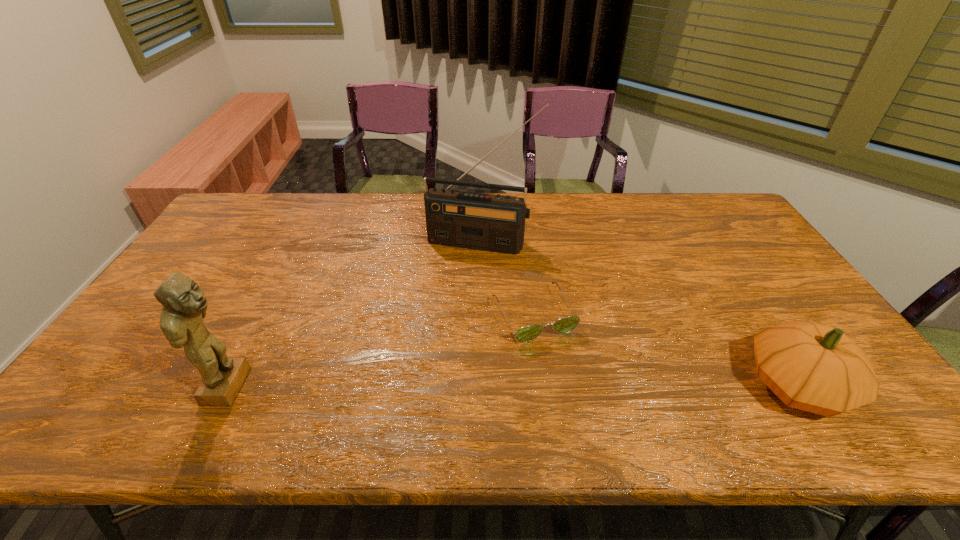
Identify the location of vacant area that lies between the leftmost object and the shortest object. (382, 350).

The width and height of the screenshot is (960, 540). I want to click on vacant space that is in between the shortest object and the third tallest object, so click(x=665, y=350).

Image resolution: width=960 pixels, height=540 pixels. What are the coordinates of `vacant space that is in between the gourd and the leftmost object` in the screenshot? It's located at (514, 386).

Identify the location of empty space that is in between the shortest object and the figurine. Image resolution: width=960 pixels, height=540 pixels. (382, 350).

Where is `object that is the third closest one to the sunglasses`? object that is the third closest one to the sunglasses is located at coordinates (184, 305).

You are a GUI agent. You are given a task and a screenshot of the screen. Output one action in this format:
    pyautogui.click(x=<x>, y=<y>)
    Task: Click on the second closest object to the gourd
    This screenshot has height=540, width=960.
    Given the screenshot: What is the action you would take?
    pyautogui.click(x=494, y=223)

What are the coordinates of `free point that satisfies the following two spatial constraints: 1. on the front side of the tallest object; 2. on the side of the third tallest object with the carved face` in the screenshot? It's located at (482, 385).

You are a GUI agent. You are given a task and a screenshot of the screen. Output one action in this format:
    pyautogui.click(x=<x>, y=<y>)
    Task: Click on the free space that satisfies the following two spatial constraints: 1. on the front side of the radio receiver; 2. on the side of the third tallest object with the carved face
    Image resolution: width=960 pixels, height=540 pixels.
    Given the screenshot: What is the action you would take?
    pyautogui.click(x=482, y=385)